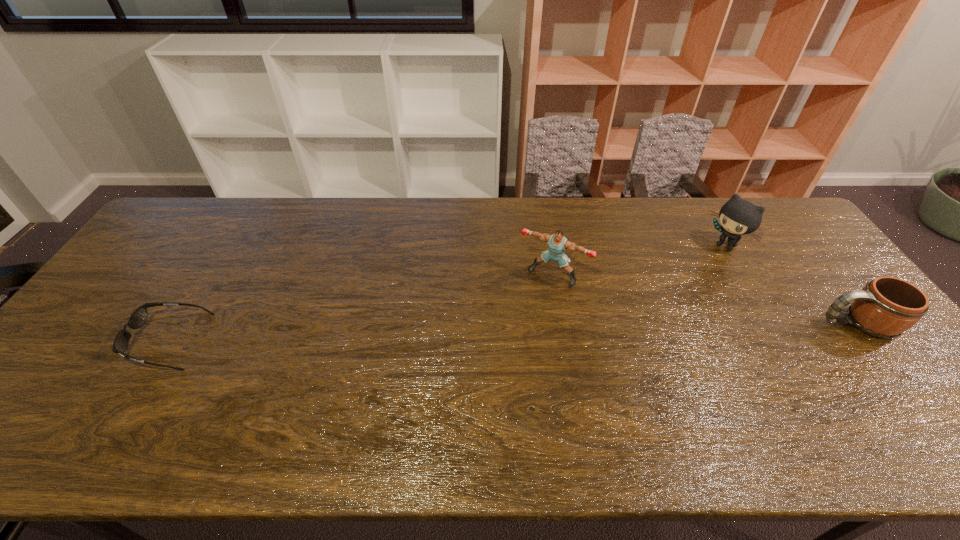
The height and width of the screenshot is (540, 960). Identify the location of vacant position located on the front-facing side of the shortest object. (80, 341).

Where is `free location located on the side of the rightmost object with the handle`? The width and height of the screenshot is (960, 540). free location located on the side of the rightmost object with the handle is located at coordinates (688, 323).

Where is `vacant space located 0.200m on the side of the rightmost object with the handle`? The width and height of the screenshot is (960, 540). vacant space located 0.200m on the side of the rightmost object with the handle is located at coordinates (745, 323).

Locate an element on the screen. vacant space positioned on the side of the rightmost object with the handle is located at coordinates (704, 323).

Locate an element on the screen. The width and height of the screenshot is (960, 540). free space located 0.390m on the front-facing side of the farthest object is located at coordinates (635, 313).

Locate an element on the screen. Image resolution: width=960 pixels, height=540 pixels. vacant space positioned on the front-facing side of the farthest object is located at coordinates click(x=668, y=289).

Locate an element on the screen. The height and width of the screenshot is (540, 960). free space located on the front-facing side of the farthest object is located at coordinates (648, 303).

Find the location of a particular element. This screenshot has height=540, width=960. vacant space located 0.260m on the front-facing side of the second farthest object is located at coordinates (497, 354).

This screenshot has height=540, width=960. Identify the location of free spot located 0.130m on the front-facing side of the second farthest object. (519, 319).

I want to click on vacant region located on the front-facing side of the second farthest object, so click(x=517, y=321).